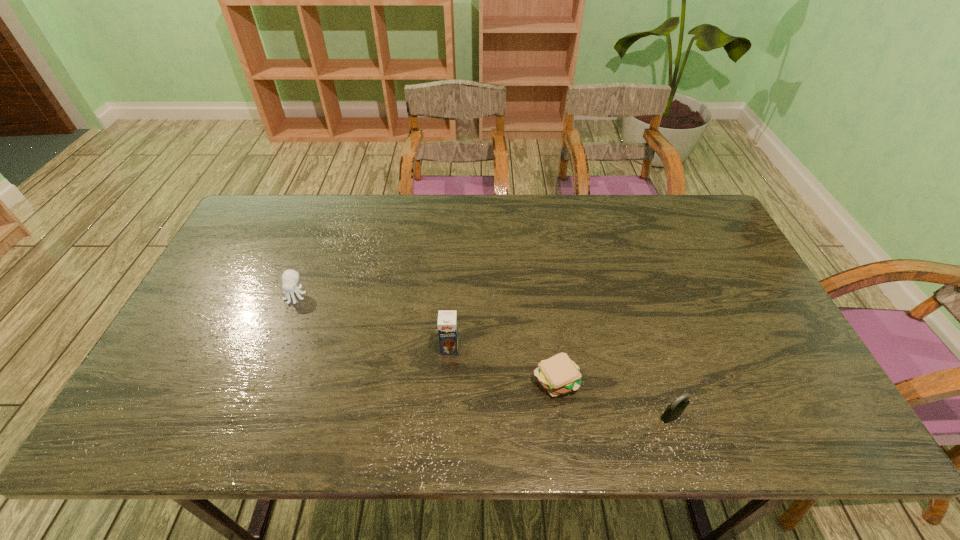
This screenshot has width=960, height=540. I want to click on blank space located on the front-facing side of the farthest object, so click(263, 377).

This screenshot has height=540, width=960. Identify the location of free space located on the right of the third object from left to right. (628, 379).

At what (x,y) coordinates should I click in order to perform the action: click on object located in the near edge section of the desktop. Please return your answer as a coordinate pair (x, y). The image size is (960, 540). Looking at the image, I should click on (674, 410).

Find the location of a particular element. vacant space at the far edge is located at coordinates (350, 224).

In the image, there is a desktop. Find the location of `vacant space at the near edge`. vacant space at the near edge is located at coordinates (483, 443).

The width and height of the screenshot is (960, 540). What are the coordinates of `vacant space at the left edge of the desktop` in the screenshot? It's located at (204, 293).

This screenshot has height=540, width=960. Identify the location of free region at the right edge. (730, 275).

Where is `blank area at the far right corner`? This screenshot has width=960, height=540. blank area at the far right corner is located at coordinates tap(704, 236).

The width and height of the screenshot is (960, 540). What are the coordinates of `free space between the farthest object and the third nearest object` in the screenshot? It's located at (372, 322).

Locate an element on the screen. The width and height of the screenshot is (960, 540). vacant area that lies between the third object from left to right and the rightmost object is located at coordinates (613, 397).